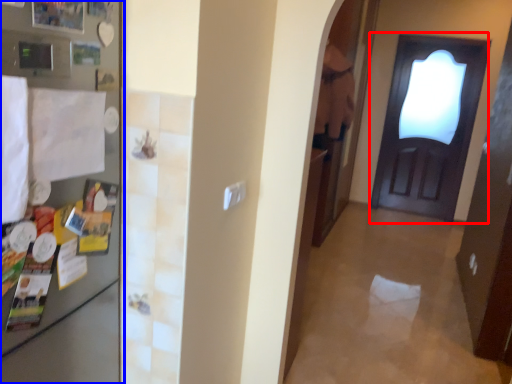
Question: Which point is further to the camera, door (highlighted by a red box) or fridge (highlighted by a blue box)?

Choices:
 (A) door
 (B) fridge

Answer: (A)